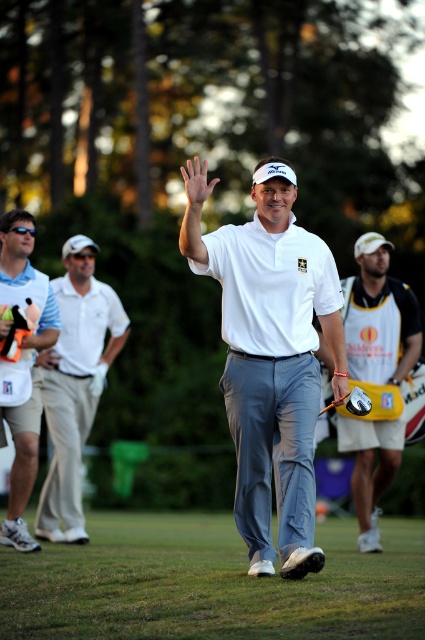
Question: Which object is positioned closest to the yellow and black golf bag at right?

Choices:
 (A) white matte shirt at center
 (B) metallic silver golf club at center

Answer: (B)

Question: Does gray fabric pants at lower center have a lesser width compared to metallic silver golf club at center?

Choices:
 (A) yes
 (B) no

Answer: (B)

Question: Which point appears closest to the camera in this image?

Choices:
 (A) (334, 404)
 (B) (17, 436)
 (C) (112, 333)

Answer: (A)

Question: Is white cotton polo shirt at left smaller than metallic silver golf club at center?

Choices:
 (A) no
 (B) yes

Answer: (A)

Question: Which point appears farthest from the camera in this image?

Choices:
 (A) (61, 346)
 (B) (25, 397)
 (C) (362, 412)
 (D) (401, 424)

Answer: (A)

Question: Does gray fabric pants at lower center have a lesser width compared to metallic silver golf club at center?

Choices:
 (A) no
 (B) yes

Answer: (A)